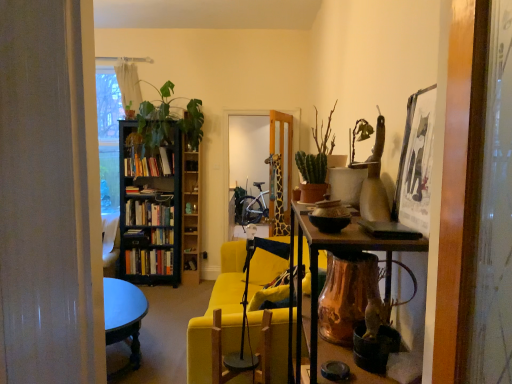
Question: Is there a large distance between hardcover books at left, placed as the 3th book when sorted from bottom to top, and green matte cactus at center?

Choices:
 (A) yes
 (B) no

Answer: (A)

Question: Is hardcover books at left, which is counted as the 2th book, starting from the top, to the left of green matte cactus at center from the viewer's perspective?

Choices:
 (A) no
 (B) yes

Answer: (B)

Question: Can we say hardcover books at left, placed as the 3th book when sorted from bottom to top, lies outside green matte cactus at center?

Choices:
 (A) no
 (B) yes

Answer: (B)

Question: Is hardcover books at left, placed as the 3th book when sorted from bottom to top, to the right of green matte cactus at center from the viewer's perspective?

Choices:
 (A) no
 (B) yes

Answer: (A)

Question: Does hardcover books at left, which is counted as the 2th book, starting from the top, have a lesser height compared to green matte cactus at center?

Choices:
 (A) no
 (B) yes

Answer: (B)

Question: Does point (225, 367) appear closer or farther from the camera than point (433, 100)?

Choices:
 (A) closer
 (B) farther

Answer: (B)

Question: Looking at their shapes, would you say wooden swivel chair at center is wider or thinner than white paper picture frame at upper right?

Choices:
 (A) thin
 (B) wide

Answer: (B)

Question: Is wooden swivel chair at center inside the boundaries of white paper picture frame at upper right, or outside?

Choices:
 (A) inside
 (B) outside

Answer: (B)

Question: Is wooden swivel chair at center taller or shorter than white paper picture frame at upper right?

Choices:
 (A) tall
 (B) short

Answer: (B)

Question: Considering their positions, is green matte cactus at center located in front of or behind hardcover books at left, placed as the 3th book when sorted from bottom to top?

Choices:
 (A) behind
 (B) front

Answer: (B)

Question: In the image, is green matte cactus at center on the left side or the right side of hardcover books at left, which is counted as the 2th book, starting from the top?

Choices:
 (A) right
 (B) left

Answer: (A)

Question: Looking at their shapes, would you say green matte cactus at center is wider or thinner than hardcover books at left, which is counted as the 2th book, starting from the top?

Choices:
 (A) wide
 (B) thin

Answer: (A)

Question: Considering the positions of green matte cactus at center and hardcover books at left, which is counted as the 2th book, starting from the top, in the image, is green matte cactus at center bigger or smaller than hardcover books at left, which is counted as the 2th book, starting from the top,?

Choices:
 (A) small
 (B) big

Answer: (A)

Question: From the image's perspective, is hardcover book at center, placed as the third book when sorted from top to bottom, located above or below wooden swivel chair at center?

Choices:
 (A) below
 (B) above

Answer: (B)

Question: Relative to wooden swivel chair at center, is hardcover book at center, placed as the third book when sorted from top to bottom, in front or behind?

Choices:
 (A) behind
 (B) front

Answer: (A)